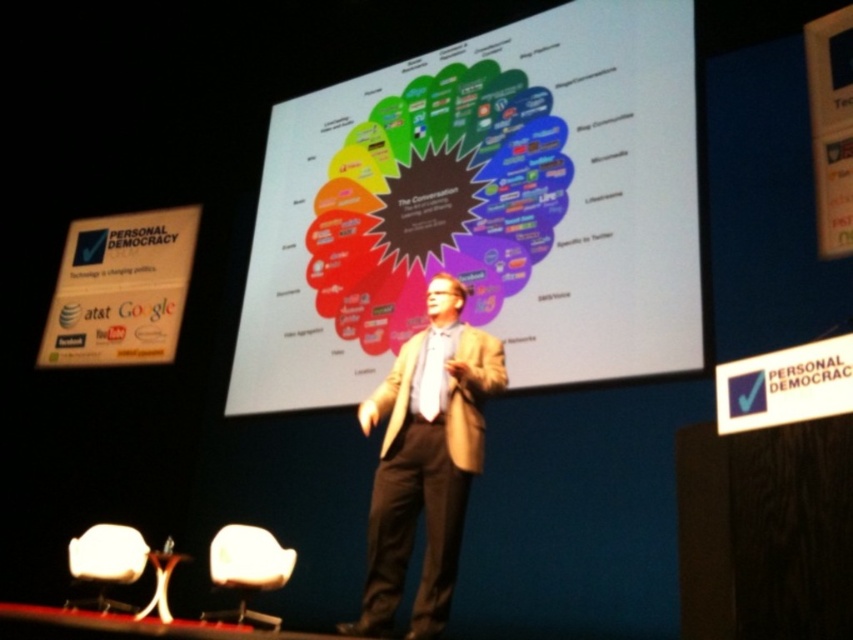
Question: Estimate the real-world distances between objects in this image. Which object is farther from the white plastic chair at lower left?

Choices:
 (A) white fabric chair at lower left
 (B) white matte projection screen at center
 (C) tan fabric suit at center

Answer: (B)

Question: Which of these objects is positioned farthest from the tan fabric suit at center?

Choices:
 (A) white plastic chair at lower left
 (B) white matte projection screen at center

Answer: (A)

Question: In this image, where is tan fabric suit at center located relative to white plastic chair at lower left?

Choices:
 (A) below
 (B) above

Answer: (B)

Question: Is tan fabric suit at center positioned before white fabric chair at lower left?

Choices:
 (A) no
 (B) yes

Answer: (B)

Question: Does white matte projection screen at center come in front of tan fabric suit at center?

Choices:
 (A) yes
 (B) no

Answer: (B)

Question: Which point appears farthest from the camera in this image?

Choices:
 (A) (102, 525)
 (B) (672, 134)

Answer: (A)